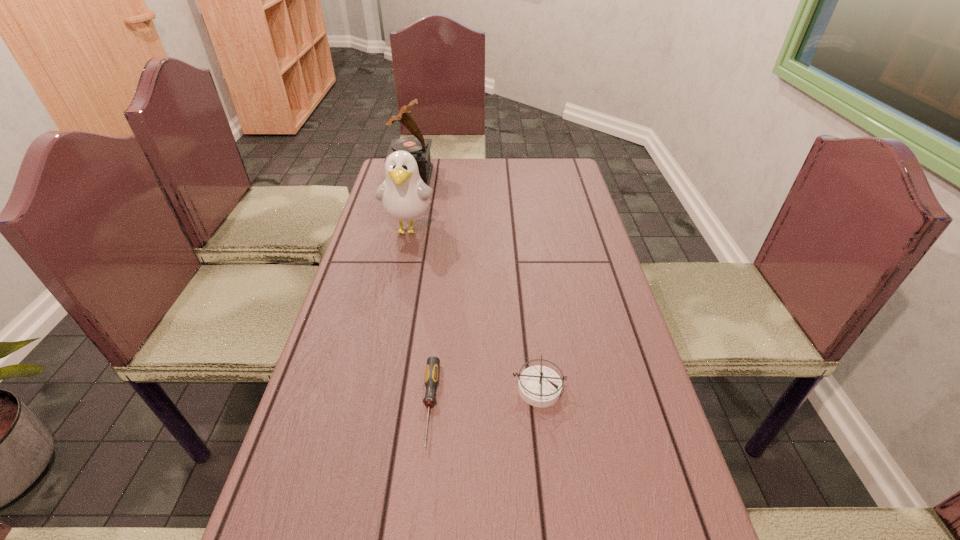
You are a GUI agent. You are given a task and a screenshot of the screen. Output one action in this format:
    pyautogui.click(x=<x>, y=<y>)
    Task: Click on the farthest object
    The image size is (960, 540).
    Given the screenshot: What is the action you would take?
    pyautogui.click(x=418, y=147)

Find the location of a particular element. The image size is (960, 540). the second farthest object is located at coordinates (404, 196).

Locate an element on the screen. the rightmost object is located at coordinates (540, 386).

In order to click on the second shortest object in this screenshot , I will do `click(540, 386)`.

Locate an element on the screen. The image size is (960, 540). screwdriver is located at coordinates (433, 363).

Identify the location of the second object from right to left. This screenshot has height=540, width=960. (433, 363).

You are a GUI agent. You are given a task and a screenshot of the screen. Output one action in this format:
    pyautogui.click(x=<x>, y=<y>)
    Task: Click on the free space located 0.390m at the horn opening of the farthest object
    This screenshot has width=960, height=540.
    Given the screenshot: What is the action you would take?
    pyautogui.click(x=535, y=176)

The image size is (960, 540). In order to click on free space located on the beak of the gull in this screenshot , I will do `click(389, 325)`.

This screenshot has height=540, width=960. I want to click on free space located 0.360m on the back of the compass, so click(x=524, y=267).

This screenshot has height=540, width=960. Identify the location of vacant region located 0.090m insert the shortest object into a screw head. (420, 500).